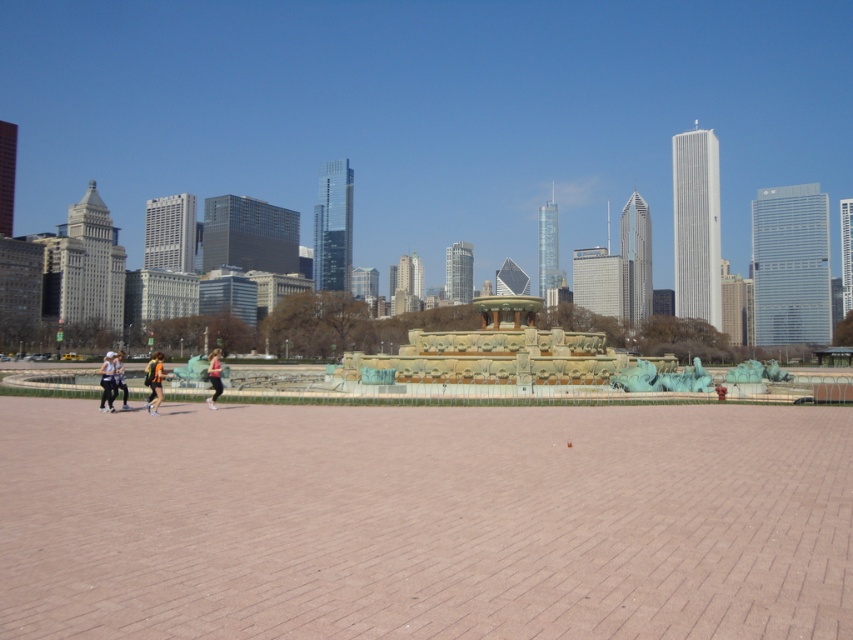
You are standing at the edge of the paved area and want to take a photo of both the matte black jacket at lower left and the matte pink leggings at center. Which object should you focus on first to ensure both are in the frame?

You should focus on the matte pink leggings at center first because the matte black jacket at lower left is in front of it, ensuring both will be visible in the frame.

You are a photographer trying to capture both the orange athletic wear at center and the matte pink leggings at center in a single shot. Based on their heights, which one would you need to focus on to ensure both are in frame?

The orange athletic wear at center is much taller than the matte pink leggings at center, so you should focus on the orange athletic wear at center to ensure both are in frame.